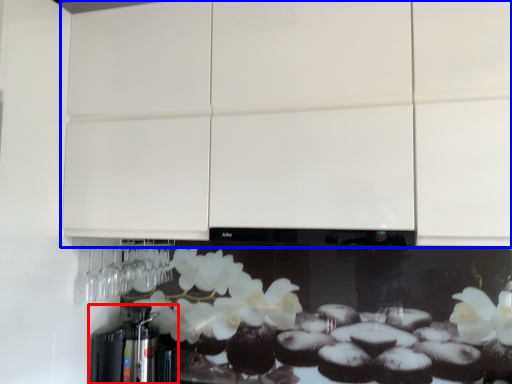
Question: Which of the following is the closest to the observer, coffee machine (highlighted by a red box) or cabinetry (highlighted by a blue box)?

Choices:
 (A) coffee machine
 (B) cabinetry

Answer: (B)